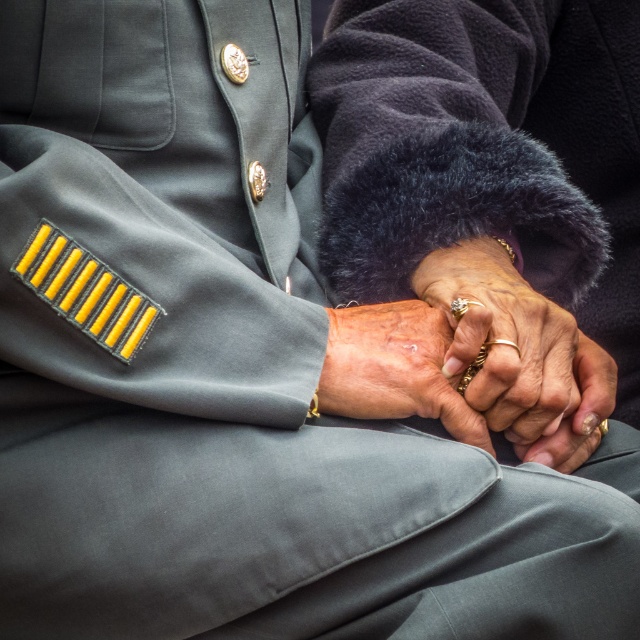
Is gold textured ring at center wider than dry skin at center?

Yes.

Between point (600, 416) and point (394, 387), which one is positioned in front?

Point (394, 387) is in front.

I want to click on gold textured ring at center, so click(x=518, y=355).